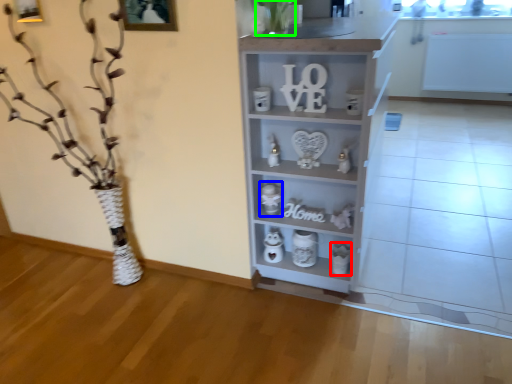
Question: Estimate the real-world distances between objects in this image. Which object is closer to toy (highlighted by a red box), toy (highlighted by a blue box) or plant (highlighted by a green box)?

Choices:
 (A) toy
 (B) plant

Answer: (A)